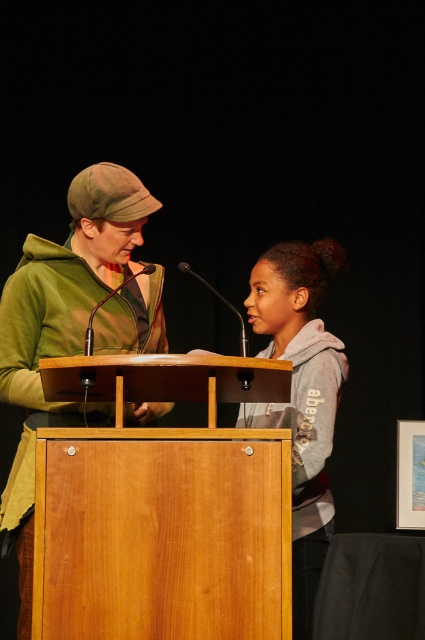
You are standing at the camera position and want to walk towards the wooden podium at center. How many steps would you need to take if each step covers approximately 2 feet?

The wooden podium at center is 6.63 feet away from the camera. Since each step covers about 2 feet, you would need approximately 3 steps to reach it.

You are organizing an event and need to set up a stage. The wooden podium at center and the green matte jacket at center are both part of the setup. If you want to ensure there is enough space for both items, which one requires more space to accommodate?

The green matte jacket at center requires more space to accommodate because the wooden podium at center occupies less space than it.